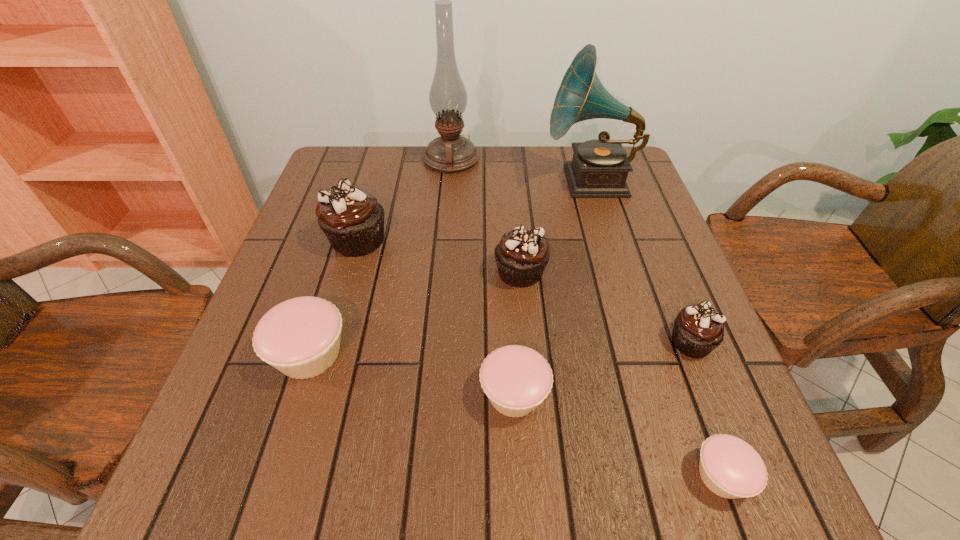
Identify the location of the third object from left to right. (451, 152).

Identify the location of bronze oil lamp. (451, 152).

Identify the location of the second tallest object. The image size is (960, 540). (599, 168).

This screenshot has height=540, width=960. I want to click on the third tallest object, so click(352, 219).

You are a GUI agent. You are given a task and a screenshot of the screen. Output one action in this format:
    pyautogui.click(x=<x>, y=<y>)
    Task: Click on the leftmost brown cupcake
    The image size is (960, 540).
    Given the screenshot: What is the action you would take?
    pyautogui.click(x=352, y=219)

The height and width of the screenshot is (540, 960). I want to click on the fifth shortest cupcake, so click(521, 256).

What are the coordinates of `the second brown cupcake from right to left` in the screenshot? It's located at (x=521, y=256).

The height and width of the screenshot is (540, 960). In order to click on the biggest pink cupcake in this screenshot , I will do `click(300, 337)`.

The width and height of the screenshot is (960, 540). Identify the location of the rightmost brown cupcake. (698, 329).

Where is `the nearest brown cupcake`? The image size is (960, 540). the nearest brown cupcake is located at coordinates (698, 329).